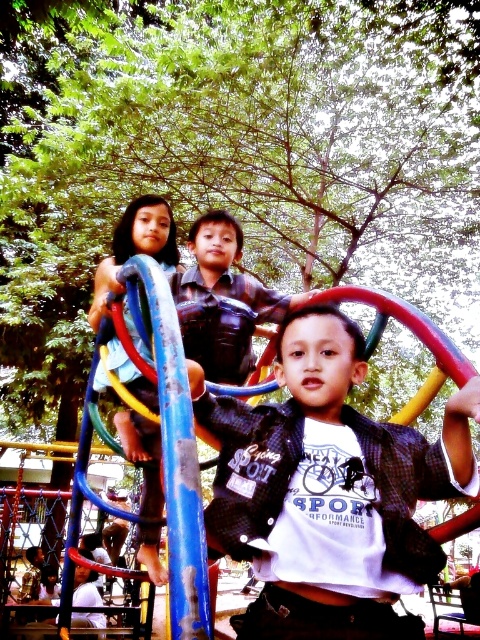
Measure the distance between point (x=315, y=378) and camera.

Point (x=315, y=378) and camera are 2.10 meters apart from each other.

Describe the element at coordinates (327, 484) in the screenshot. I see `matte black shirt at center` at that location.

Image resolution: width=480 pixels, height=640 pixels. Identify the location of matte black shirt at center. (327, 484).

How far apart are matte black shirt at center and matte blue pole at center?

matte black shirt at center is 4.36 feet away from matte blue pole at center.

Can you confirm if matte black shirt at center is taller than matte blue pole at center?

In fact, matte black shirt at center may be shorter than matte blue pole at center.

Does point (420, 497) lie behind point (194, 292)?

No, (420, 497) is in front of (194, 292).

Where is `matte black shirt at center`? Image resolution: width=480 pixels, height=640 pixels. matte black shirt at center is located at coordinates (327, 484).

Consider the image. Does matte blue pole at center have a lesser width compared to light blue fabric at left?

Incorrect, matte blue pole at center's width is not less than light blue fabric at left's.

Does matte blue pole at center have a greater height compared to light blue fabric at left?

No.

Who is more forward, (210, 317) or (155, 436)?

Point (210, 317) is in front.

The width and height of the screenshot is (480, 640). In order to click on matte blue pole at center in this screenshot , I will do `click(222, 298)`.